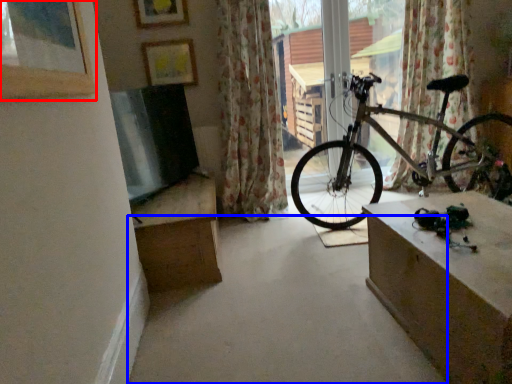
Question: Which point is further to the camera, picture frame (highlighted by a red box) or concrete (highlighted by a blue box)?

Choices:
 (A) picture frame
 (B) concrete

Answer: (B)